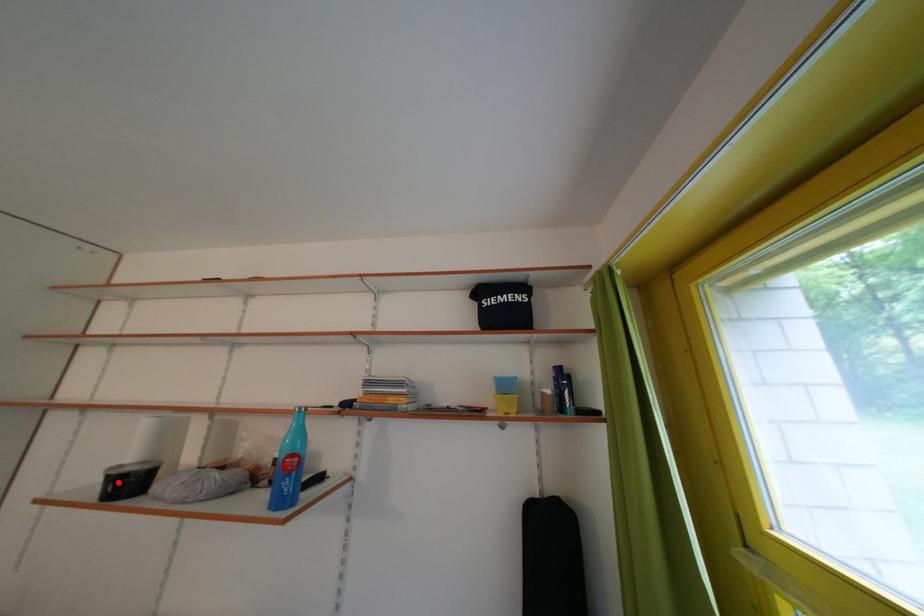
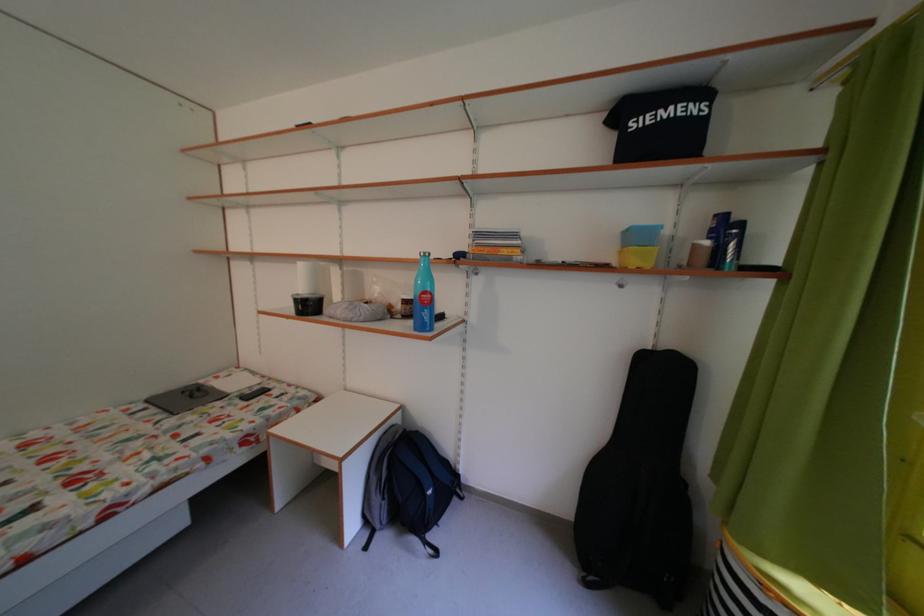
Question: I am providing you with two images of the same scene from different viewpoints. Image1 has a red point marked. In image2, the corresponding 3D location appears at what relative position? Reply with the corresponding letter.

Choices:
 (A) Closer
 (B) Farther

Answer: (B)